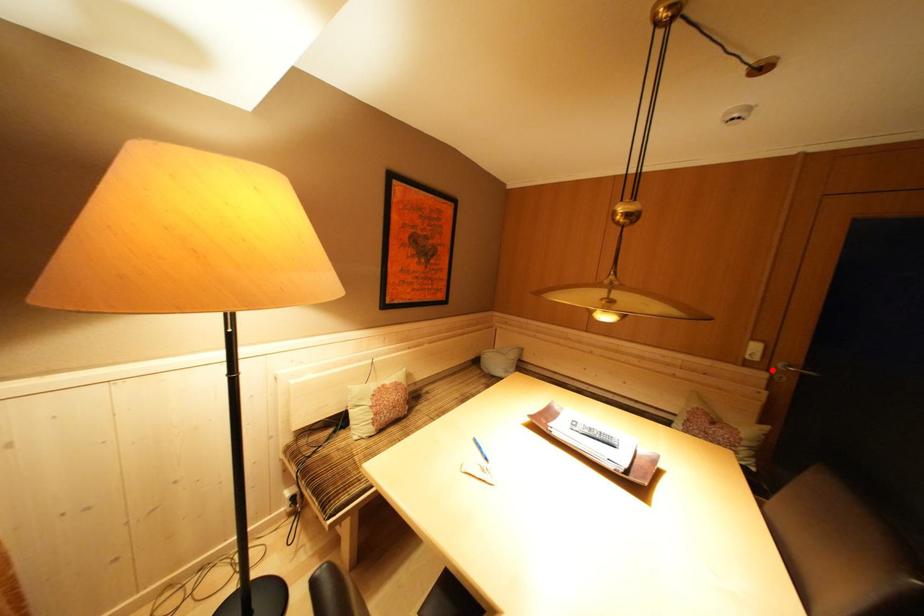
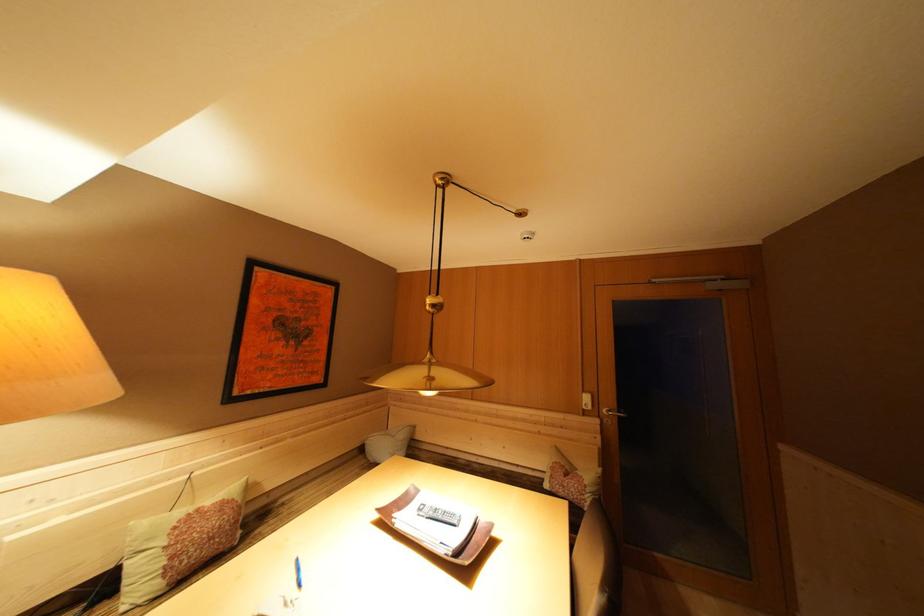
Question: I am providing you with two images of the same scene from different viewpoints. Image1 has a red point marked. In image2, the corresponding 3D location appears at what relative position? Reply with the corresponding letter.

Choices:
 (A) Closer
 (B) Farther

Answer: (B)